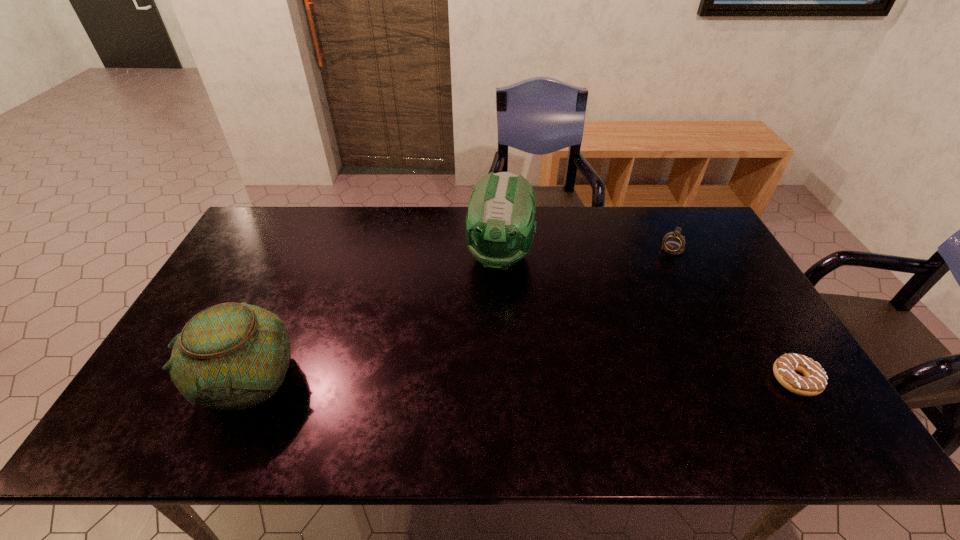
The width and height of the screenshot is (960, 540). Find the location of `free space at the far right corner of the desktop`. free space at the far right corner of the desktop is located at coordinates (703, 221).

This screenshot has width=960, height=540. I want to click on unoccupied position between the second object from right to left and the leftmost object, so point(460,314).

At what (x,y) coordinates should I click in order to perform the action: click on free space between the compass and the rightmost object. Please return your answer as a coordinate pair (x, y). The height and width of the screenshot is (540, 960). Looking at the image, I should click on (733, 314).

Locate an element on the screen. This screenshot has width=960, height=540. unoccupied position between the tallest object and the doughnut is located at coordinates (648, 318).

Where is `free space that is in between the pottery and the tallest object`? free space that is in between the pottery and the tallest object is located at coordinates (374, 317).

Identify the location of vacant point located between the second object from left to right and the second shortest object. This screenshot has height=540, width=960. (586, 252).

Locate an element on the screen. free area in between the pottery and the third tallest object is located at coordinates (460, 314).

Image resolution: width=960 pixels, height=540 pixels. What are the coordinates of `vacant area that lies between the doughnut and the second shortest object` in the screenshot? It's located at (733, 314).

Locate an element on the screen. This screenshot has height=540, width=960. vacant space that is in between the third tallest object and the football helmet is located at coordinates (586, 252).

Locate an element on the screen. This screenshot has height=540, width=960. free space between the doughnut and the second shortest object is located at coordinates (733, 314).